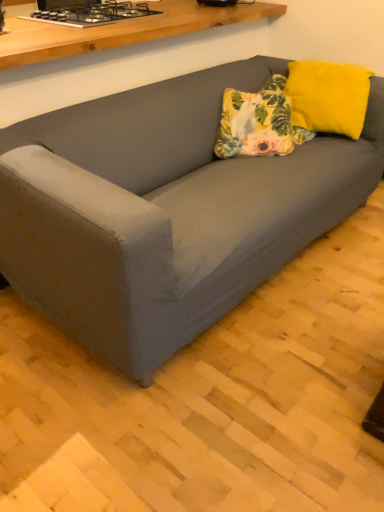
The image size is (384, 512). Describe the element at coordinates (328, 96) in the screenshot. I see `yellow fuzzy pillow at upper right` at that location.

Locate an element on the screen. black glass stove at upper left is located at coordinates (91, 13).

Locate an element on the screen. floral fabric pillow at center is located at coordinates (258, 122).

Describe the element at coordinates (258, 122) in the screenshot. The width and height of the screenshot is (384, 512). I see `floral fabric pillow at center` at that location.

You are a GUI agent. You are given a task and a screenshot of the screen. Output one action in this format:
    pyautogui.click(x=<x>, y=<y>)
    Task: Click on the suede gray couch at center
    The height and width of the screenshot is (512, 384).
    Given the screenshot: What is the action you would take?
    pyautogui.click(x=164, y=211)

Locate an element on the screen. This screenshot has width=384, height=512. throw pillow located on the right of suede gray couch at center is located at coordinates (258, 122).

Which object is positioned more to the right, suede gray couch at center or floral fabric pillow at center?

From the viewer's perspective, floral fabric pillow at center appears more on the right side.

From the image's perspective, is suede gray couch at center above or below floral fabric pillow at center?

From the image's perspective, suede gray couch at center appears above floral fabric pillow at center.

How many degrees apart are the facing directions of yellow fuzzy pillow at upper right and suede gray couch at center?

The angle between the facing direction of yellow fuzzy pillow at upper right and the facing direction of suede gray couch at center is 111 degrees.

Consider the image. Is yellow fuzzy pillow at upper right inside or outside of suede gray couch at center?

yellow fuzzy pillow at upper right lies outside suede gray couch at center.

From a real-world perspective, is yellow fuzzy pillow at upper right positioned above or below suede gray couch at center?

yellow fuzzy pillow at upper right is above suede gray couch at center.

From the picture: Between yellow fuzzy pillow at upper right and suede gray couch at center, which one appears on the left side from the viewer's perspective?

From the viewer's perspective, suede gray couch at center appears more on the left side.

In terms of height, does suede gray couch at center look taller or shorter compared to black glass stove at upper left?

Clearly, suede gray couch at center is taller compared to black glass stove at upper left.

Is black glass stove at upper left completely or partially inside suede gray couch at center?

Absolutely, black glass stove at upper left is inside suede gray couch at center.

From the image's perspective, is suede gray couch at center beneath black glass stove at upper left?

Yes.

What's the angular difference between suede gray couch at center and black glass stove at upper left's facing directions?

The angular difference between suede gray couch at center and black glass stove at upper left is 0.000193 degrees.

From a real-world perspective, which object stands above the other?

black glass stove at upper left.

Identify the location of stove behind the suede gray couch at center. Image resolution: width=384 pixels, height=512 pixels. (91, 13).

Is black glass stove at upper left situated inside suede gray couch at center or outside?

The correct answer is: inside.

Is black glass stove at upper left to the left or to the right of suede gray couch at center in the image?

black glass stove at upper left is positioned on suede gray couch at center's left side.

Can you confirm if yellow fuzzy pillow at upper right is smaller than black glass stove at upper left?

No.

Is yellow fuzzy pillow at upper right oriented towards black glass stove at upper left?

No.

Considering the sizes of yellow fuzzy pillow at upper right and black glass stove at upper left in the image, is yellow fuzzy pillow at upper right wider or thinner than black glass stove at upper left?

yellow fuzzy pillow at upper right is thinner than black glass stove at upper left.

From the image's perspective, which is above, suede gray couch at center or yellow fuzzy pillow at upper right?

suede gray couch at center, from the image's perspective.

Is suede gray couch at center far away from yellow fuzzy pillow at upper right?

They are positioned close to each other.

Considering the sizes of objects suede gray couch at center and yellow fuzzy pillow at upper right in the image provided, who is shorter, suede gray couch at center or yellow fuzzy pillow at upper right?

With less height is yellow fuzzy pillow at upper right.

Could you tell me if suede gray couch at center is turned towards yellow fuzzy pillow at upper right?

No.

Is floral fabric pillow at center at the left side of suede gray couch at center?

In fact, floral fabric pillow at center is to the right of suede gray couch at center.

Is point (292, 150) positioned behind point (179, 124)?

That is True.

Can suede gray couch at center be found inside floral fabric pillow at center?

That's incorrect, suede gray couch at center is not inside floral fabric pillow at center.

In terms of height, does floral fabric pillow at center look taller or shorter compared to suede gray couch at center?

Clearly, floral fabric pillow at center is shorter compared to suede gray couch at center.

In order to click on throw pillow that is below the suede gray couch at center (from the image's perspective) in this screenshot , I will do `click(258, 122)`.

Where is `pillow that is behind the suede gray couch at center`? pillow that is behind the suede gray couch at center is located at coordinates (328, 96).

Consider the image. When comparing their distances from floral fabric pillow at center, does black glass stove at upper left or suede gray couch at center seem further?

The object further to floral fabric pillow at center is black glass stove at upper left.

Based on their spatial positions, is floral fabric pillow at center or black glass stove at upper left further from yellow fuzzy pillow at upper right?

black glass stove at upper left lies further to yellow fuzzy pillow at upper right than the other object.

Estimate the real-world distances between objects in this image. Which object is closer to floral fabric pillow at center, suede gray couch at center or yellow fuzzy pillow at upper right?

The object closer to floral fabric pillow at center is yellow fuzzy pillow at upper right.

Looking at the image, which one is located further to suede gray couch at center, floral fabric pillow at center or black glass stove at upper left?

black glass stove at upper left is positioned further to the anchor suede gray couch at center.

Considering their positions, is suede gray couch at center positioned further to yellow fuzzy pillow at upper right than black glass stove at upper left?

black glass stove at upper left.

Estimate the real-world distances between objects in this image. Which object is further from black glass stove at upper left, suede gray couch at center or yellow fuzzy pillow at upper right?

Based on the image, yellow fuzzy pillow at upper right appears to be further to black glass stove at upper left.

When comparing their distances from black glass stove at upper left, does floral fabric pillow at center or yellow fuzzy pillow at upper right seem closer?

floral fabric pillow at center is positioned closer to the anchor black glass stove at upper left.

When comparing their distances from floral fabric pillow at center, does yellow fuzzy pillow at upper right or suede gray couch at center seem further?

Based on the image, suede gray couch at center appears to be further to floral fabric pillow at center.

The width and height of the screenshot is (384, 512). I want to click on studio couch between black glass stove at upper left and floral fabric pillow at center from left to right, so click(164, 211).

This screenshot has width=384, height=512. I want to click on studio couch between black glass stove at upper left and yellow fuzzy pillow at upper right, so click(x=164, y=211).

This screenshot has height=512, width=384. Find the location of `throw pillow between suede gray couch at center and yellow fuzzy pillow at upper right from left to right`. throw pillow between suede gray couch at center and yellow fuzzy pillow at upper right from left to right is located at coordinates (258, 122).

I want to click on throw pillow situated between black glass stove at upper left and yellow fuzzy pillow at upper right from left to right, so click(x=258, y=122).